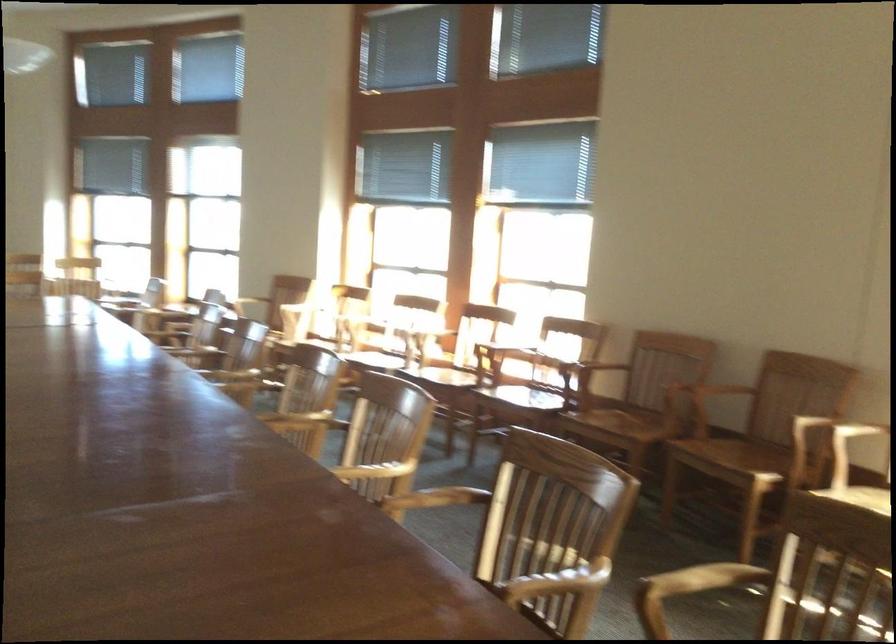
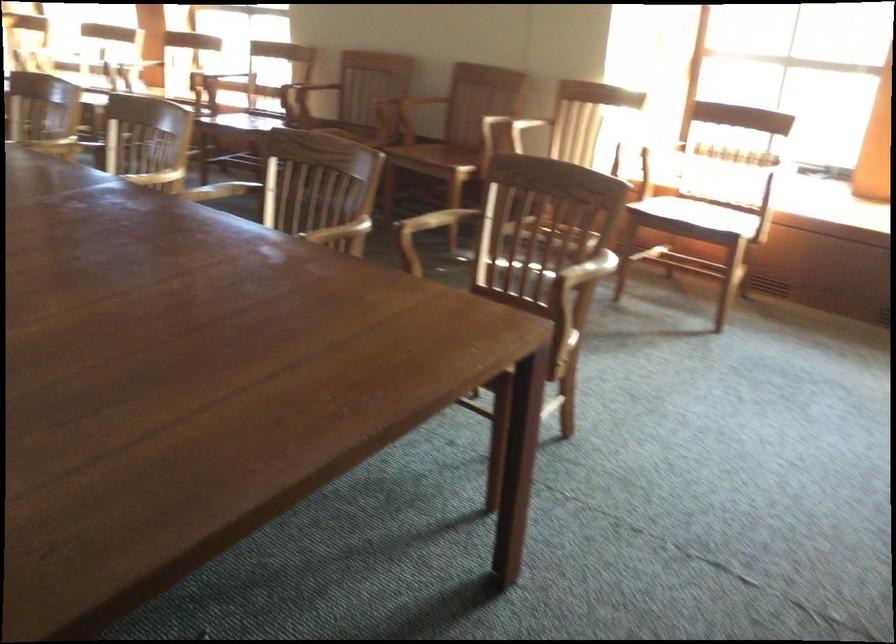
In the second image, find the point that corresponds to pixel 444 498 in the first image.

(219, 190)